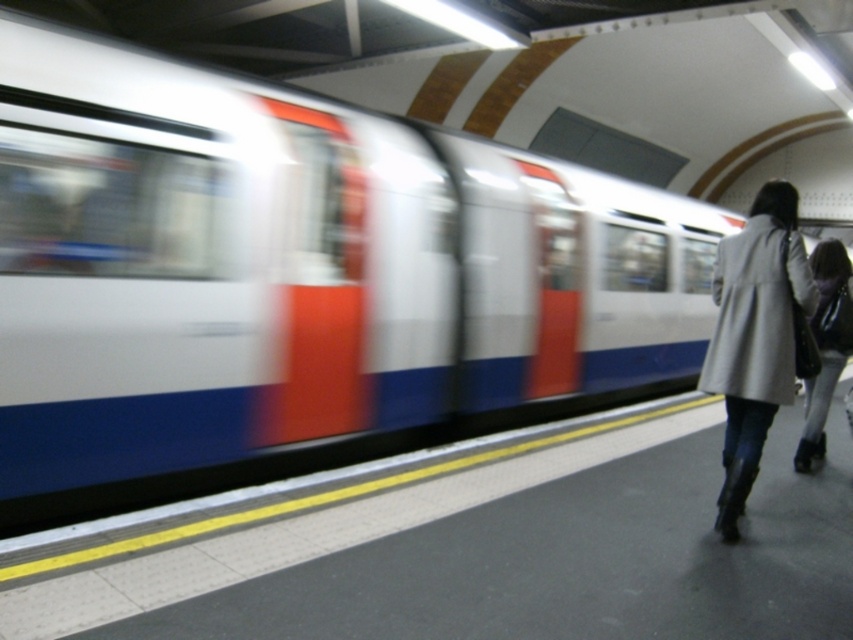
Question: Among these points, which one is farthest from the camera?

Choices:
 (A) (799, 276)
 (B) (815, 412)

Answer: (B)

Question: Is gray wool coat at right positioned behind matte gray coat at right?

Choices:
 (A) yes
 (B) no

Answer: (B)

Question: Which point is farther to the camera?

Choices:
 (A) (773, 205)
 (B) (817, 328)

Answer: (B)

Question: Which point is closer to the camera?

Choices:
 (A) (755, 312)
 (B) (843, 332)

Answer: (A)

Question: Does gray wool coat at right have a smaller size compared to matte gray coat at right?

Choices:
 (A) yes
 (B) no

Answer: (A)

Question: Is gray wool coat at right to the right of matte gray coat at right from the viewer's perspective?

Choices:
 (A) yes
 (B) no

Answer: (B)